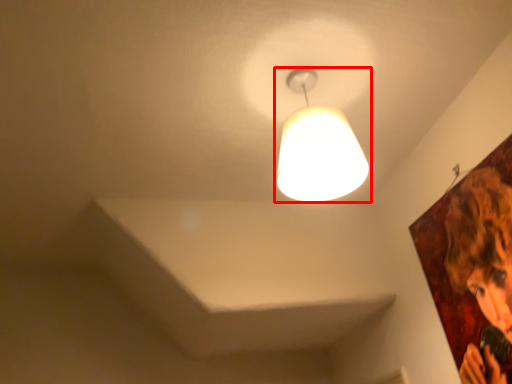
Question: In this image, where is lamp (annotated by the red box) located relative to person?

Choices:
 (A) left
 (B) right

Answer: (A)